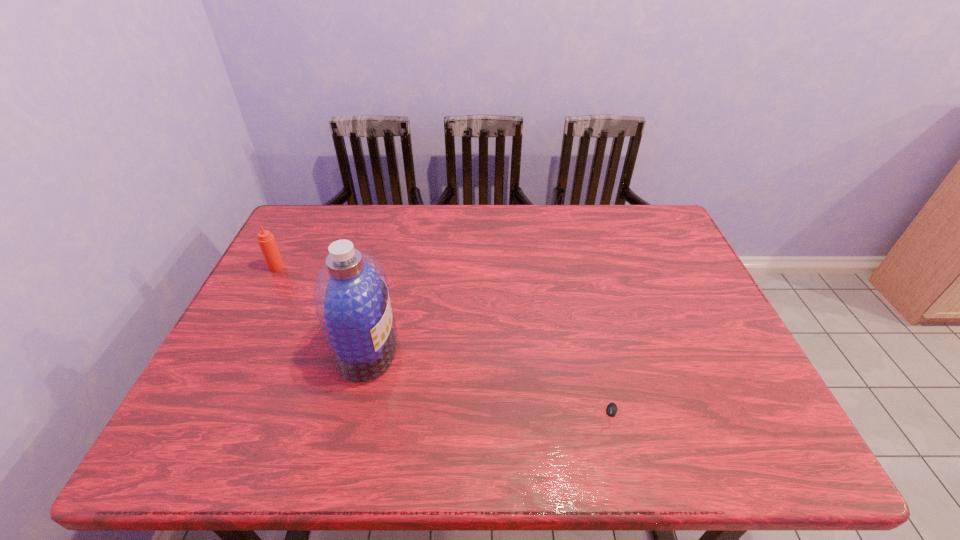
The image size is (960, 540). What are the coordinates of `cleansing agent` in the screenshot? It's located at (351, 298).

The height and width of the screenshot is (540, 960). What are the coordinates of `the tallest object` in the screenshot? It's located at [x=351, y=298].

The height and width of the screenshot is (540, 960). Identify the location of the leftmost object. click(x=266, y=240).

This screenshot has height=540, width=960. In order to click on Tabasco sauce in this screenshot , I will do `click(266, 240)`.

Locate an element on the screen. This screenshot has width=960, height=540. the shortest object is located at coordinates (611, 409).

You are a GUI agent. You are given a task and a screenshot of the screen. Output one action in this format:
    pyautogui.click(x=<x>, y=<y>)
    Task: Click on the mouse
    
    Given the screenshot: What is the action you would take?
    pyautogui.click(x=611, y=409)

This screenshot has height=540, width=960. I want to click on vacant position located 0.240m on the left of the cleansing agent, so click(238, 349).

Identify the location of vacant space located on the front of the second shortest object. The height and width of the screenshot is (540, 960). coord(250,319).

The width and height of the screenshot is (960, 540). Find the location of `vacant region located 0.090m on the right of the rightmost object`. vacant region located 0.090m on the right of the rightmost object is located at coordinates coord(661,418).

Identify the location of object that is at the near edge. The width and height of the screenshot is (960, 540). (611, 409).